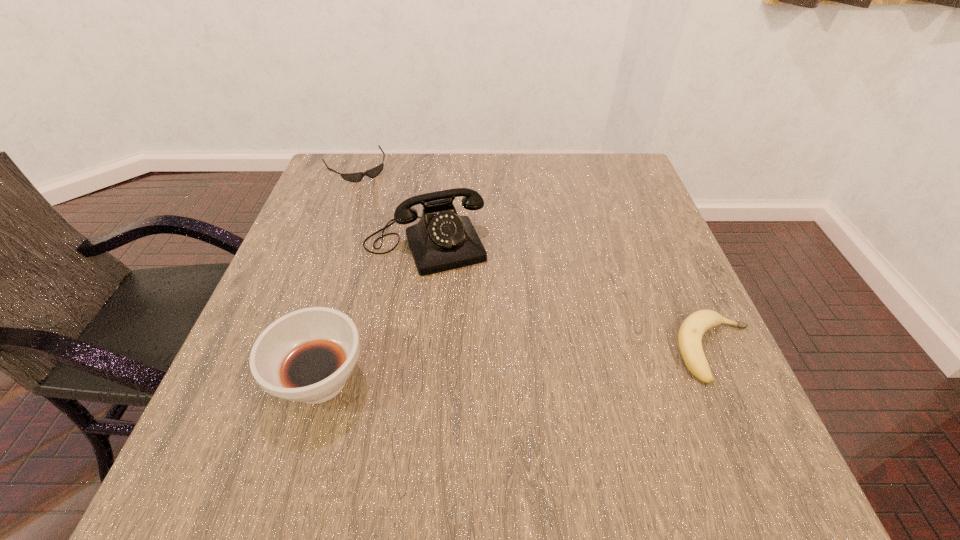
Identify the location of free space between the second tallest object and the second farthest object. (372, 312).

You are a GUI agent. You are given a task and a screenshot of the screen. Output one action in this format:
    pyautogui.click(x=<x>, y=<y>)
    Task: Click on the free space between the second farthest object and the rightmost object
    This screenshot has height=540, width=960.
    Given the screenshot: What is the action you would take?
    pyautogui.click(x=570, y=298)

Where is `vacant region between the sunglasses and the rightmost object`? vacant region between the sunglasses and the rightmost object is located at coordinates (536, 259).

You are a GUI agent. You are given a task and a screenshot of the screen. Output one action in this format:
    pyautogui.click(x=<x>, y=<y>)
    Task: Click on the vacant area between the second farthest object and the shortest object
    The height and width of the screenshot is (540, 960).
    Given the screenshot: What is the action you would take?
    pyautogui.click(x=390, y=206)

Find the location of a particular element. empty location between the banana and the tallest object is located at coordinates (570, 298).

What are the coordinates of `vacant space that is in between the sunglasses and the second tallest object` in the screenshot? It's located at (338, 274).

Locate an element on the screen. This screenshot has width=960, height=540. empty space that is in between the second shortest object and the telephone is located at coordinates (570, 298).

The height and width of the screenshot is (540, 960). What are the coordinates of `vacant area between the rightmost object and the soup bowl` in the screenshot? It's located at (518, 365).

The image size is (960, 540). In order to click on empty location between the third shortest object and the telephone in this screenshot , I will do `click(372, 312)`.

Find the location of `vacant point located between the third shortest object and the sunglasses`. vacant point located between the third shortest object and the sunglasses is located at coordinates (338, 274).